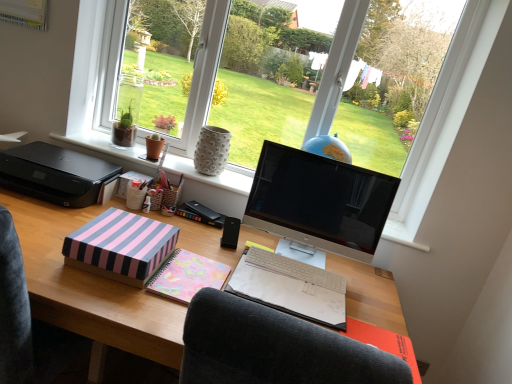
You are a GUI agent. You are given a task and a screenshot of the screen. Output one action in this format:
    pyautogui.click(x=<x>, y=<y>)
    Task: Click on the sleek black monitor at center
    This screenshot has height=384, width=512.
    Given the screenshot: What is the action you would take?
    pyautogui.click(x=320, y=201)

Describe the element at coordinates (210, 177) in the screenshot. The height and width of the screenshot is (384, 512). I see `white textured vase at center` at that location.

In order to face white plastic keyboard at center, should I rotate leftwards or rightwards?

You should rotate right by 5.538 degrees.

What do you see at coordinates (296, 269) in the screenshot?
I see `white plastic keyboard at center` at bounding box center [296, 269].

Find the location of a particular element. This screenshot has width=512, height=384. pastel butterfly-patterned paper at center is located at coordinates (187, 276).

The height and width of the screenshot is (384, 512). What do you see at coordinates (200, 214) in the screenshot?
I see `pink striped paper at center` at bounding box center [200, 214].

The image size is (512, 384). What are the coordinates of `black plastic speaker at center` in the screenshot? It's located at (230, 233).

Does point (411, 355) come behind point (224, 224)?

No, (411, 355) is in front of (224, 224).

In the scene shown: What's the angular difference between pastel pink paper at lower right and black plastic speaker at center's facing directions?

They differ by 15.9 degrees in their facing directions.

From a real-world perspective, which is physically below, pastel pink paper at lower right or black plastic speaker at center?

pastel pink paper at lower right, from a real-world perspective.

Is pink striped paper at center at the back of black plastic speaker at center?

No.

Considering the positions of objects black plastic speaker at center and pink striped paper at center in the image provided, who is behind, black plastic speaker at center or pink striped paper at center?

pink striped paper at center is more distant.

Based on the photo, how much distance is there between black plastic speaker at center and pink striped paper at center?

black plastic speaker at center and pink striped paper at center are 5.24 inches apart.

Is black plastic speaker at center surrounding pink striped paper at center?

Actually, pink striped paper at center is outside black plastic speaker at center.

How much distance is there between black plastic speaker at center and white plastic keyboard at center?

A distance of 9.25 inches exists between black plastic speaker at center and white plastic keyboard at center.

In the scene shown: Is black plastic speaker at center shorter than white plastic keyboard at center?

Incorrect, the height of black plastic speaker at center does not fall short of that of white plastic keyboard at center.

Considering the relative sizes of black plastic speaker at center and white plastic keyboard at center in the image provided, is black plastic speaker at center thinner than white plastic keyboard at center?

Yes.

Considering the relative sizes of black plastic speaker at center and white plastic keyboard at center in the image provided, is black plastic speaker at center smaller than white plastic keyboard at center?

Result: Yes.

Is sleek black monitor at center in front of or behind pastel pink paper at lower right in the image?

Visually, sleek black monitor at center is located behind pastel pink paper at lower right.

Does sleek black monitor at center have a smaller size compared to pastel pink paper at lower right?

No, sleek black monitor at center is not smaller than pastel pink paper at lower right.

Is sleek black monitor at center facing away from pastel pink paper at lower right?

No, sleek black monitor at center is not facing the opposite direction of pastel pink paper at lower right.

Is black plastic speaker at center at the right side of white textured vase at center?

Yes.

From a real-world perspective, between black plastic speaker at center and white textured vase at center, who is vertically lower?

black plastic speaker at center is physically lower.

Looking at this image, from the image's perspective, is black plastic speaker at center positioned above or below white textured vase at center?

From the image's perspective, black plastic speaker at center appears below white textured vase at center.

Does black plastic speaker at center have a greater width compared to white textured vase at center?

No.

Between pastel butterfly-patterned paper at center and black plastic printer at left, which one appears on the right side from the viewer's perspective?

pastel butterfly-patterned paper at center.

Which of these two, pastel butterfly-patterned paper at center or black plastic printer at left, is wider?

Wider between the two is black plastic printer at left.

Looking at this image, from the image's perspective, between pastel butterfly-patterned paper at center and black plastic printer at left, who is located below?

pastel butterfly-patterned paper at center.

In the scene shown: Does pastel butterfly-patterned paper at center turn towards black plastic printer at left?

No, pastel butterfly-patterned paper at center is not facing towards black plastic printer at left.

From the image's perspective, between wooden desk at center and pastel floral notebook at center, which one is located above?

pastel floral notebook at center, from the image's perspective.

Considering the relative sizes of wooden desk at center and pastel floral notebook at center in the image provided, is wooden desk at center bigger than pastel floral notebook at center?

Yes.

From a real-world perspective, does wooden desk at center sit lower than pastel floral notebook at center?

Yes, from a real-world perspective, wooden desk at center is beneath pastel floral notebook at center.

This screenshot has width=512, height=384. I want to click on notepad on the right side of black plastic speaker at center, so click(384, 343).

This screenshot has width=512, height=384. Identify the location of book on the left of black plastic speaker at center. (200, 214).

From the picture: When comparing their distances from pink striped cardboard box at center-left, does pastel butterfly-patterned paper at center or pastel pink paper at lower right seem closer?

pastel butterfly-patterned paper at center is positioned closer to the anchor pink striped cardboard box at center-left.

Looking at the image, which one is located further to sleek black monitor at center, black plastic printer at left or white textured vase at center?

Based on the image, black plastic printer at left appears to be further to sleek black monitor at center.

Which object lies nearer to the anchor point black plastic printer at left, black plastic speaker at center or pink striped cardboard box at center-left?

pink striped cardboard box at center-left.

Estimate the real-world distances between objects in this image. Which object is further from pastel butterfly-patterned paper at center, black plastic speaker at center or pink striped paper at center?

pink striped paper at center is further to pastel butterfly-patterned paper at center.

From the image, which object appears to be farther from sleek black monitor at center, pastel floral notebook at center or wooden desk at center?

Based on the image, wooden desk at center appears to be further to sleek black monitor at center.

Which object lies nearer to the anchor point pastel floral notebook at center, wooden desk at center or white plastic keyboard at center?

white plastic keyboard at center is positioned closer to the anchor pastel floral notebook at center.

Based on the photo, based on their spatial positions, is wooden desk at center or black plastic printer at left closer to white textured vase at center?

black plastic printer at left lies closer to white textured vase at center than the other object.

When comparing their distances from pastel butterfly-patterned paper at center, does white textured vase at center or black plastic speaker at center seem further?

The object further to pastel butterfly-patterned paper at center is white textured vase at center.

I want to click on notebook positioned between pastel butterfly-patterned paper at center and pink striped paper at center from near to far, so click(x=291, y=287).

Where is `speaker between white textured vase at center and white plastic keyboard at center in the vertical direction`? This screenshot has height=384, width=512. speaker between white textured vase at center and white plastic keyboard at center in the vertical direction is located at coordinates (230, 233).

Locate an element on the screen. computer keyboard between wooden desk at center and white textured vase at center along the z-axis is located at coordinates (296, 269).

Find the location of `notebook located between wooden desk at center and white textured vase at center in the depth direction`. notebook located between wooden desk at center and white textured vase at center in the depth direction is located at coordinates (291, 287).